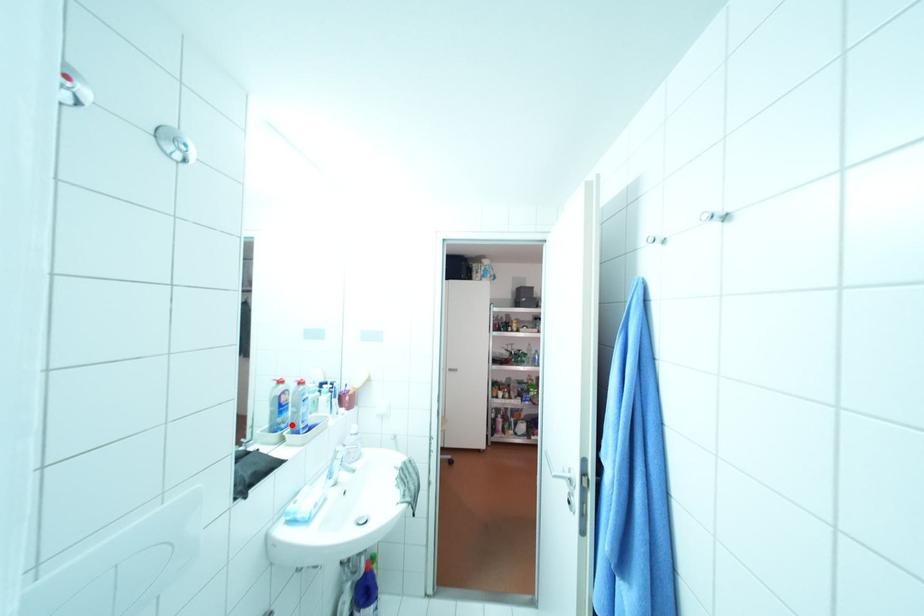
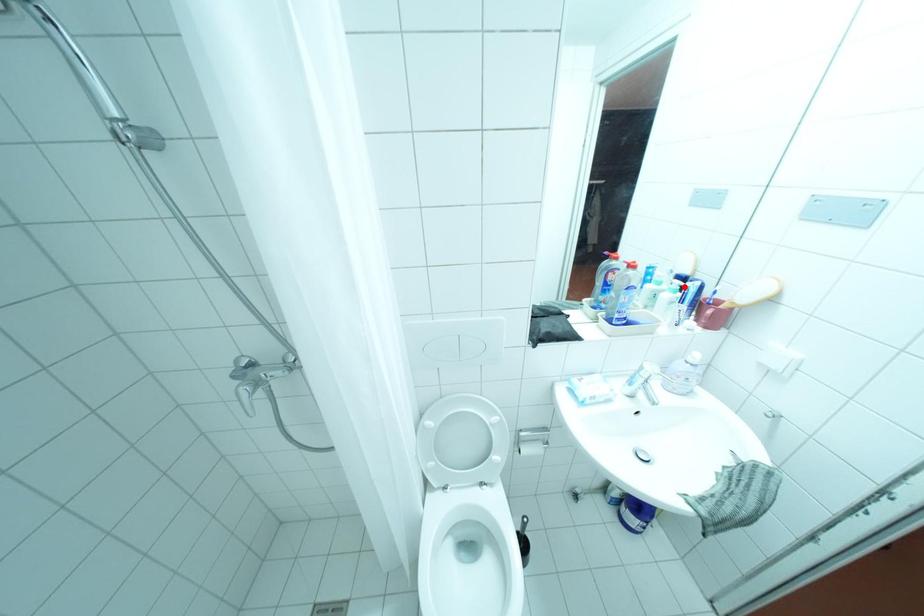
Looking at this image, I am providing you with two images of the same scene from different viewpoints. A red point is marked on the first image and another point is marked on the second image. Is the marked point in image1 the same physical position as the marked point in image2?

No